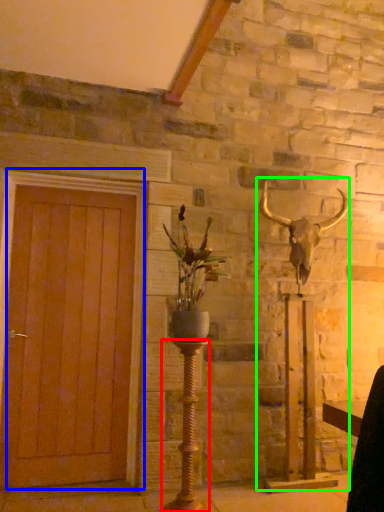
Question: Which object is the farthest from candle holder (highlighted by a red box)? Choose among these: door (highlighted by a blue box) or sculpture (highlighted by a green box).

Choices:
 (A) door
 (B) sculpture

Answer: (B)